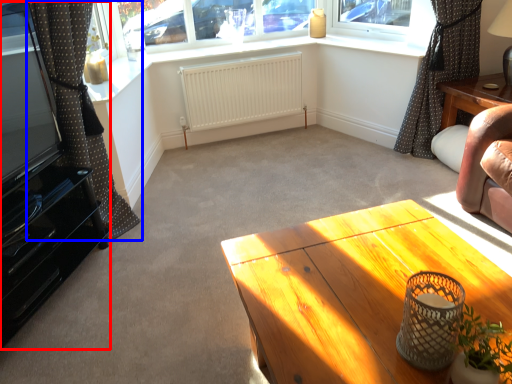
Question: Which object is closer to the camera taking this photo, entertainment center (highlighted by a red box) or curtain (highlighted by a blue box)?

Choices:
 (A) entertainment center
 (B) curtain

Answer: (A)